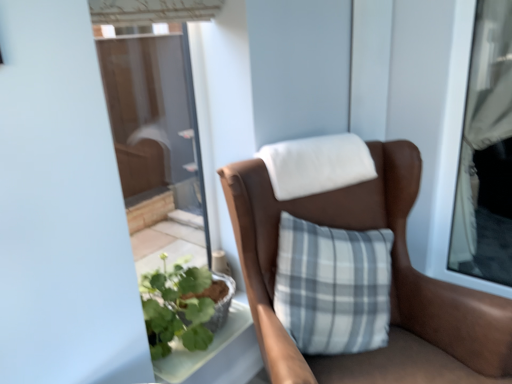
Question: From a real-world perspective, is matte white curtain at right physically located above or below brown leather chair at center?

Choices:
 (A) above
 (B) below

Answer: (A)

Question: Which is correct: matte white curtain at right is inside brown leather chair at center, or outside of it?

Choices:
 (A) outside
 (B) inside

Answer: (A)

Question: Is matte white curtain at right in front of or behind brown leather chair at center in the image?

Choices:
 (A) front
 (B) behind

Answer: (B)

Question: From a real-world perspective, is brown leather chair at center above or below matte white curtain at right?

Choices:
 (A) above
 (B) below

Answer: (B)

Question: Considering their positions, is brown leather chair at center located in front of or behind matte white curtain at right?

Choices:
 (A) behind
 (B) front

Answer: (B)

Question: Is point (315, 220) positioned closer to the camera than point (509, 261)?

Choices:
 (A) farther
 (B) closer

Answer: (B)

Question: From the image's perspective, is brown leather chair at center positioned above or below matte white curtain at right?

Choices:
 (A) above
 (B) below

Answer: (B)